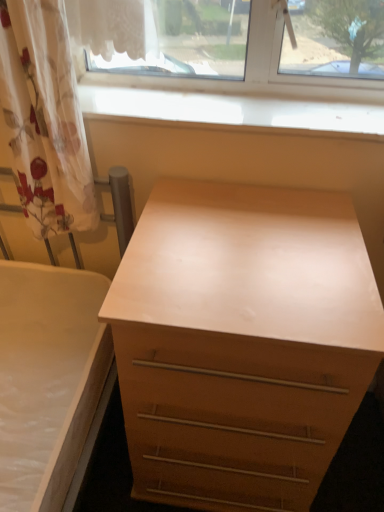
At what (x,y) coordinates should I click in order to perform the action: click on free location above smooth wood window sill at upper center (from a real-world perspective). Please return your answer as a coordinate pair (x, y). Looking at the image, I should click on (231, 104).